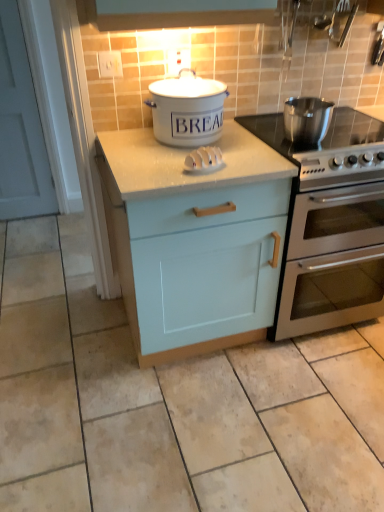
Identify the location of free space to the left of light blue wood cabinet at center. The width and height of the screenshot is (384, 512). 69,352.